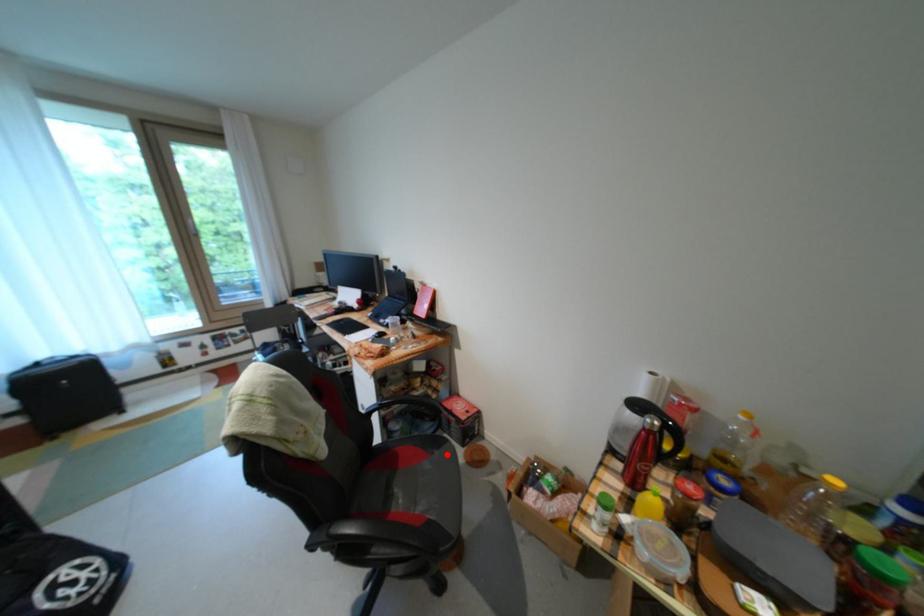
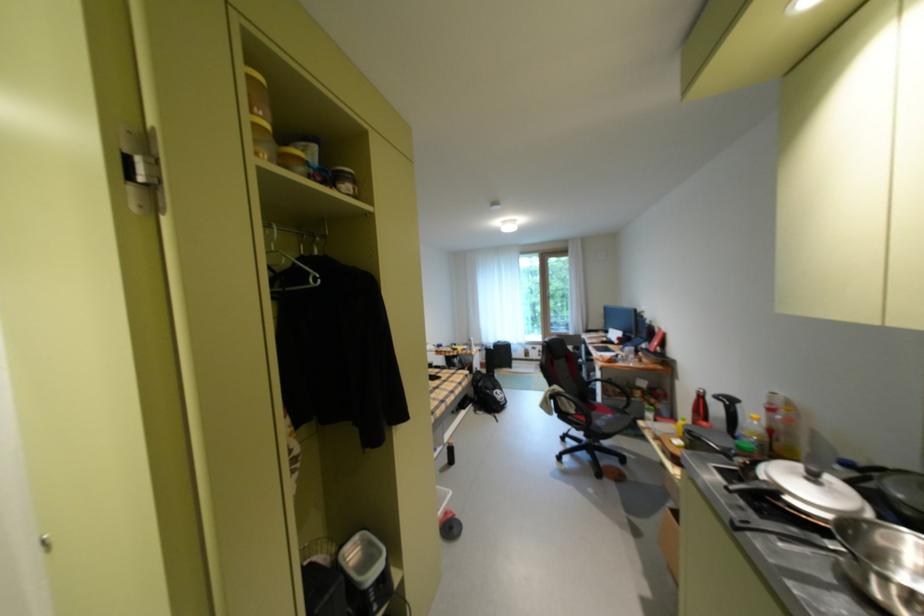
Where in the second image is the point corresponding to the highlighted location from the first image?

(629, 416)